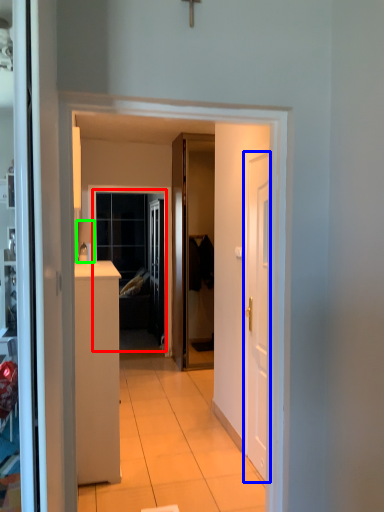
Question: Which object is the closest to the window (highlighted by a red box)? Choose among these: door (highlighted by a blue box) or lamp (highlighted by a green box).

Choices:
 (A) door
 (B) lamp

Answer: (B)